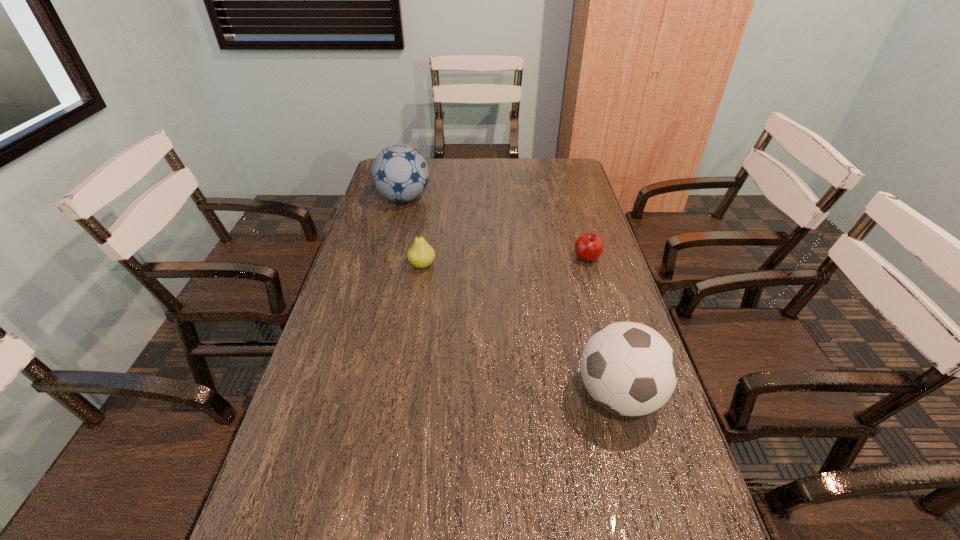
At what (x,y) coordinates should I click in order to perform the action: click on object that is at the far edge. Please return your answer as a coordinate pair (x, y). Looking at the image, I should click on (400, 173).

Locate an element on the screen. The height and width of the screenshot is (540, 960). object present at the left edge is located at coordinates (400, 173).

Find the location of a particular element. The width and height of the screenshot is (960, 540). soccer ball located at the right edge is located at coordinates (628, 368).

I want to click on apple that is at the right edge, so click(x=588, y=247).

Locate an element on the screen. object at the far left corner is located at coordinates (400, 173).

At what (x,y) coordinates should I click in order to perform the action: click on free space at the far edge of the desktop. Please return your answer as a coordinate pair (x, y). Looking at the image, I should click on (476, 158).

The image size is (960, 540). I want to click on blank space at the right edge, so click(x=587, y=193).

In order to click on vacant space at the far right corner of the desktop in this screenshot , I will do `click(571, 181)`.

Locate an element on the screen. free space between the farthest object and the nearer soccer ball is located at coordinates (511, 296).

Find the location of a particular element. free space between the pear and the shortest object is located at coordinates (505, 261).